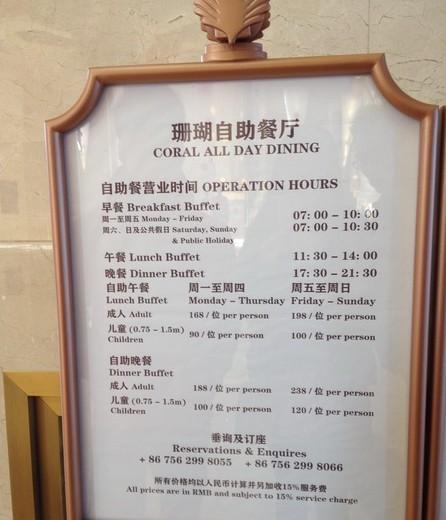
Identify the location of wall behing top of menu. This screenshot has height=520, width=446. (312, 19).